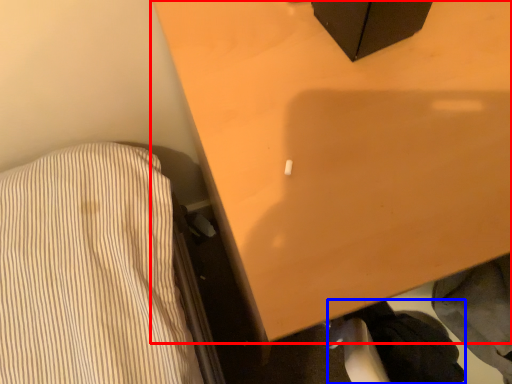
Question: Among these objects, which one is nearest to the camera, furniture (highlighted by a red box) or clothing (highlighted by a blue box)?

Choices:
 (A) furniture
 (B) clothing

Answer: (A)